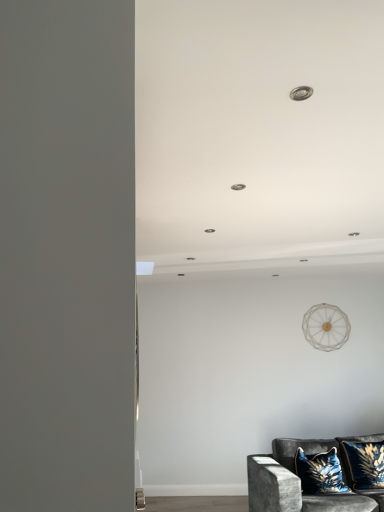
Question: Considering the positions of velvet blue pillow at lower right, placed as the first pillow when sorted from right to left, and velvet blue pillow at lower right, the 2th pillow positioned from the right, in the image, is velvet blue pillow at lower right, placed as the first pillow when sorted from right to left, bigger or smaller than velvet blue pillow at lower right, the 2th pillow positioned from the right,?

Choices:
 (A) small
 (B) big

Answer: (A)

Question: From the image's perspective, is velvet blue pillow at lower right, placed as the first pillow when sorted from right to left, positioned above or below velvet blue pillow at lower right, the 2th pillow positioned from the right?

Choices:
 (A) above
 (B) below

Answer: (A)

Question: Considering the real-world distances, which object is farthest from the velvet blue pillow at lower right, the 2th pillow positioned from the right?

Choices:
 (A) velvet blue pillow at lower right, which appears as the 2th pillow when viewed from the left
 (B) velvet dark gray couch at lower right

Answer: (A)

Question: Which is nearer to the velvet dark gray couch at lower right?

Choices:
 (A) velvet blue pillow at lower right, placed as the first pillow when sorted from right to left
 (B) velvet blue pillow at lower right, marked as the first pillow in a left-to-right arrangement

Answer: (B)